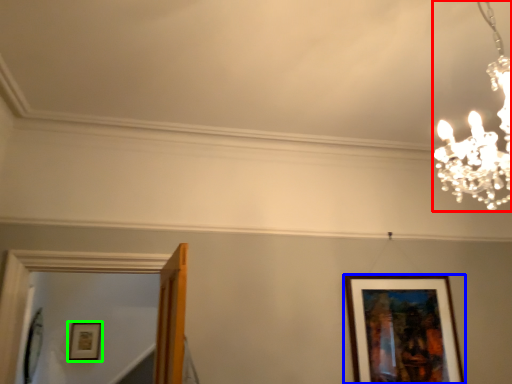
Question: Which is farther away from lamp (highlighted by a red box)? picture frame (highlighted by a blue box) or picture frame (highlighted by a green box)?

Choices:
 (A) picture frame
 (B) picture frame

Answer: (B)